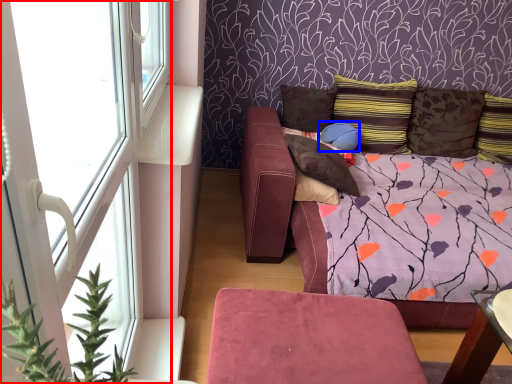
Question: Which point is closer to the camera, window (highlighted by a red box) or pillow (highlighted by a blue box)?

Choices:
 (A) window
 (B) pillow

Answer: (A)